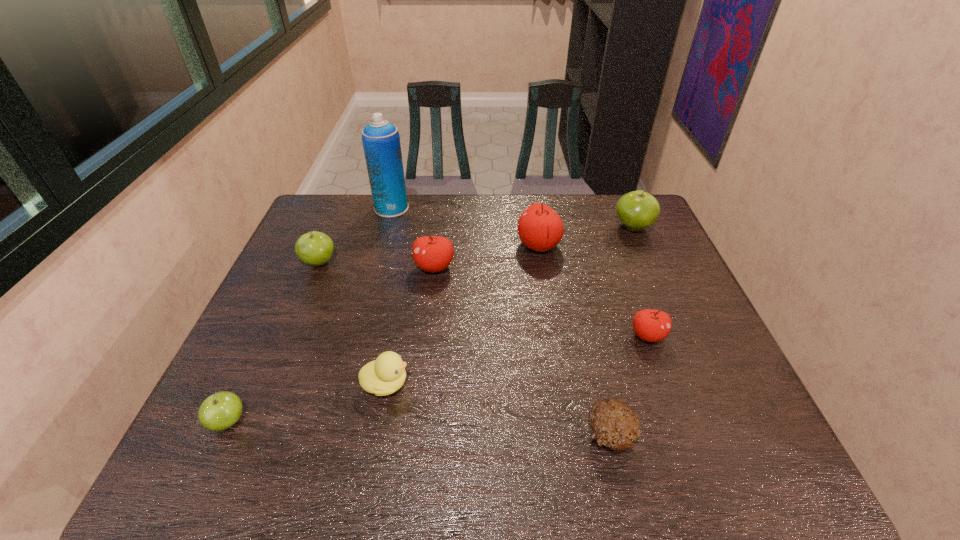
Where is `empty space that is in between the fourth apple from right to left and the fourth apple from left to right`? empty space that is in between the fourth apple from right to left and the fourth apple from left to right is located at coordinates (487, 256).

Identify the location of object that stands as the eighth closest to the second nearest green apple. click(x=637, y=210).

Choose which object is the fourth nearest neighbor to the leftmost red apple. Please provide its 2D coordinates. Your answer should be formatted as a tuple, i.e. [(x, y)], where the tuple contains the x and y coordinates of a point satisfying the conditions above.

[(385, 375)]

You are a GUI agent. You are given a task and a screenshot of the screen. Output one action in this format:
    pyautogui.click(x=<x>, y=<y>)
    Task: Click on the apple that is the fourth closest to the fourth nearest object
    The width and height of the screenshot is (960, 540).
    Given the screenshot: What is the action you would take?
    pyautogui.click(x=314, y=248)

Select which apple appears as the second closest to the rightmost green apple. Please provide its 2D coordinates. Your answer should be formatted as a tuple, i.e. [(x, y)], where the tuple contains the x and y coordinates of a point satisfying the conditions above.

[(650, 325)]

You are a GUI agent. You are given a task and a screenshot of the screen. Output one action in this format:
    pyautogui.click(x=<x>, y=<y>)
    Task: Click on the red apple that is the nearest to the seventh farthest object
    
    Given the screenshot: What is the action you would take?
    pyautogui.click(x=431, y=253)

Locate which red apple is the third closest to the rightmost green apple. Please provide its 2D coordinates. Your answer should be formatted as a tuple, i.e. [(x, y)], where the tuple contains the x and y coordinates of a point satisfying the conditions above.

[(431, 253)]

Image resolution: width=960 pixels, height=540 pixels. Identify the location of the closest green apple to the rightmost red apple. (637, 210).

Find the location of a particular element. This screenshot has height=540, width=960. the closest green apple to the fourth apple from right to left is located at coordinates (314, 248).

In order to click on free location that satisfies the following two spatial constraints: 1. on the back side of the muffin; 2. at the beak of the yellow duckling in this screenshot , I will do `click(598, 384)`.